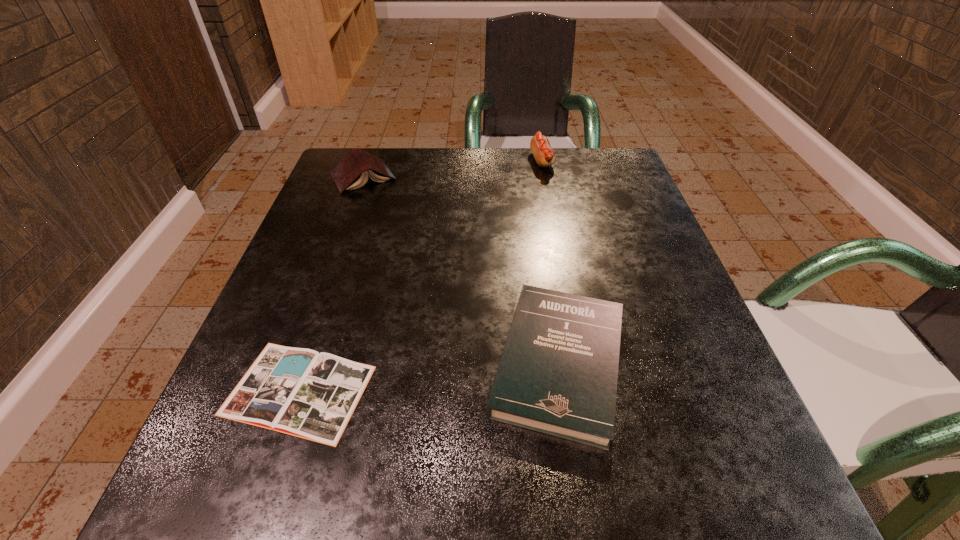
Where is `book that is at the far edge`? Image resolution: width=960 pixels, height=540 pixels. book that is at the far edge is located at coordinates (352, 171).

I want to click on object that is at the right edge, so click(x=558, y=374).

Find the location of a particular element. object that is at the far left corner is located at coordinates (x=352, y=171).

This screenshot has height=540, width=960. In the image, there is a desktop. What are the coordinates of `free space at the far edge` in the screenshot? It's located at (527, 191).

Locate an element on the screen. Image resolution: width=960 pixels, height=540 pixels. vacant region at the near edge of the desktop is located at coordinates (398, 486).

This screenshot has width=960, height=540. In the image, there is a desktop. Identify the location of free space at the right edge. (630, 342).

In the image, there is a desktop. Identify the location of vacant space at the far left corner. (368, 199).

You are a GUI agent. You are given a task and a screenshot of the screen. Output one action in this format:
    pyautogui.click(x=<x>, y=<y>)
    Task: Click on the vacant region between the shortest book and the rightmost book
    The height and width of the screenshot is (540, 960).
    Given the screenshot: What is the action you would take?
    pyautogui.click(x=429, y=376)

Where is `empty space that is in between the farthest book and the second shortest object`? empty space that is in between the farthest book and the second shortest object is located at coordinates (461, 269).

At what (x,y) coordinates should I click in order to perform the action: click on free space between the shortest book and the second shortest book. Please return your answer as a coordinate pair (x, y). The image size is (960, 540). Looking at the image, I should click on point(429,376).